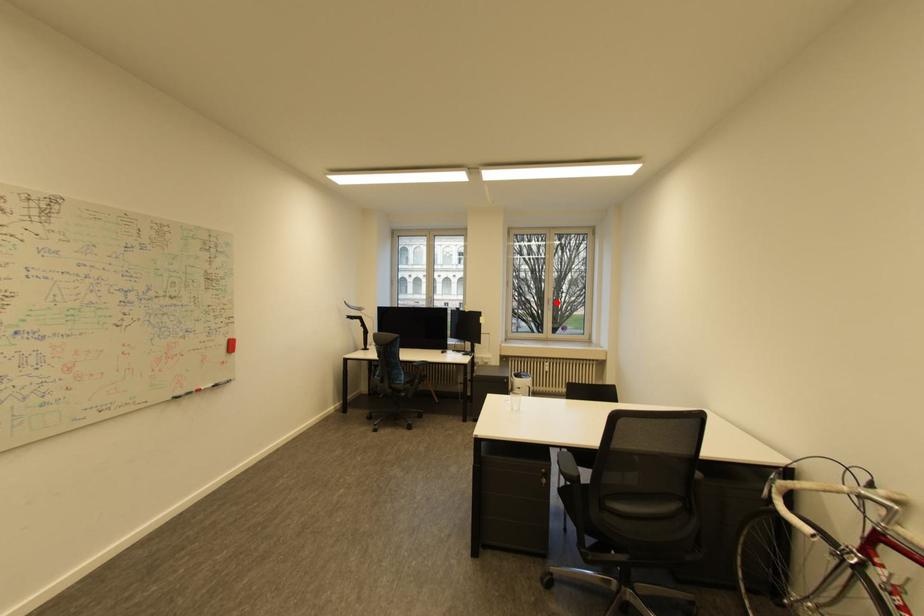
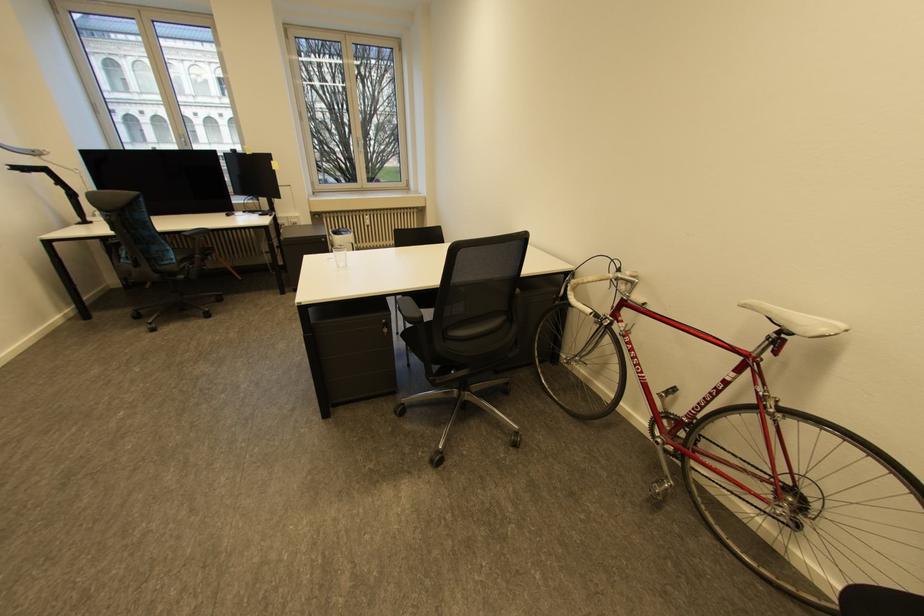
Locate, in the second image, the point that corresponds to the highlighted location in the first image.

(367, 143)